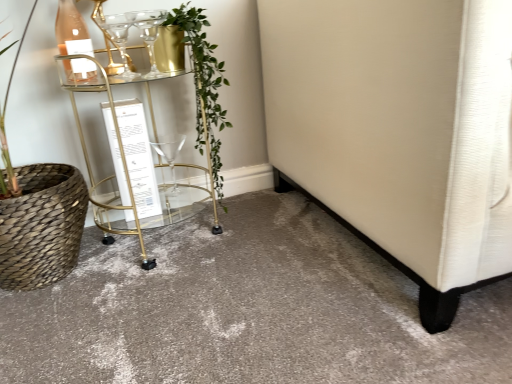
Question: Does clear glass wine glass at upper left, the 2th wine glass from the bottom, lie behind green leafy plant at center?

Choices:
 (A) no
 (B) yes

Answer: (B)

Question: From a real-world perspective, is clear glass wine glass at upper left, the 1th wine glass when ordered from top to bottom, located higher than green leafy plant at center?

Choices:
 (A) yes
 (B) no

Answer: (A)

Question: From the image's perspective, would you say clear glass wine glass at upper left, the 2th wine glass from the bottom, is positioned over green leafy plant at center?

Choices:
 (A) no
 (B) yes

Answer: (B)

Question: Considering the relative sizes of clear glass wine glass at upper left, the 1th wine glass when ordered from top to bottom, and green leafy plant at center in the image provided, is clear glass wine glass at upper left, the 1th wine glass when ordered from top to bottom, bigger than green leafy plant at center?

Choices:
 (A) no
 (B) yes

Answer: (A)

Question: Is clear glass wine glass at upper left, the first wine glass in the front-to-back sequence, outside green leafy plant at center?

Choices:
 (A) no
 (B) yes

Answer: (B)

Question: Which is correct: clear glass wine glass at upper left, the 1th wine glass when ordered from top to bottom, is inside gold metallic bar cart at center, or outside of it?

Choices:
 (A) outside
 (B) inside

Answer: (B)

Question: Based on their sizes in the image, would you say clear glass wine glass at upper left, positioned as the 2th wine glass in back-to-front order, is bigger or smaller than gold metallic bar cart at center?

Choices:
 (A) big
 (B) small

Answer: (B)

Question: Considering the relative positions of clear glass wine glass at upper left, the 2th wine glass from the bottom, and gold metallic bar cart at center in the image provided, is clear glass wine glass at upper left, the 2th wine glass from the bottom, to the left or to the right of gold metallic bar cart at center?

Choices:
 (A) left
 (B) right

Answer: (A)

Question: In terms of width, does clear glass wine glass at upper left, positioned as the 2th wine glass in back-to-front order, look wider or thinner when compared to gold metallic bar cart at center?

Choices:
 (A) wide
 (B) thin

Answer: (B)

Question: Is green leafy plant at center bigger or smaller than matte glass bottle at upper left?

Choices:
 (A) big
 (B) small

Answer: (A)

Question: From a real-world perspective, is green leafy plant at center above or below matte glass bottle at upper left?

Choices:
 (A) above
 (B) below

Answer: (B)

Question: Considering the positions of green leafy plant at center and matte glass bottle at upper left in the image, is green leafy plant at center taller or shorter than matte glass bottle at upper left?

Choices:
 (A) tall
 (B) short

Answer: (A)

Question: In the image, is green leafy plant at center positioned in front of or behind matte glass bottle at upper left?

Choices:
 (A) behind
 (B) front

Answer: (B)

Question: Considering the positions of green leafy plant at center and clear glass wine glass at upper left, positioned as the 2th wine glass in back-to-front order, in the image, is green leafy plant at center wider or thinner than clear glass wine glass at upper left, positioned as the 2th wine glass in back-to-front order,?

Choices:
 (A) thin
 (B) wide

Answer: (B)

Question: From a real-world perspective, is green leafy plant at center physically located above or below clear glass wine glass at upper left, the 2th wine glass from the bottom?

Choices:
 (A) below
 (B) above

Answer: (A)